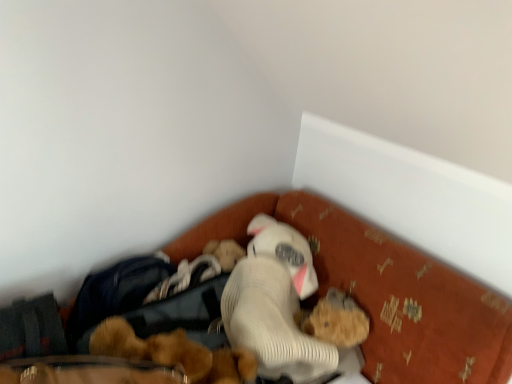
Question: Can you confirm if velvet orange bed at lower center is bigger than fluffy brown teddy bear at center, the second toy when ordered from right to left?

Choices:
 (A) yes
 (B) no

Answer: (A)

Question: Are velvet orange bed at lower center and fluffy brown teddy bear at center, the second toy when ordered from right to left, beside each other?

Choices:
 (A) yes
 (B) no

Answer: (B)

Question: Considering the relative sizes of velvet orange bed at lower center and fluffy brown teddy bear at center, the second toy when ordered from right to left, in the image provided, is velvet orange bed at lower center thinner than fluffy brown teddy bear at center, the second toy when ordered from right to left,?

Choices:
 (A) yes
 (B) no

Answer: (B)

Question: Does velvet orange bed at lower center appear on the left side of fluffy brown teddy bear at center, positioned as the 1th toy in left-to-right order?

Choices:
 (A) yes
 (B) no

Answer: (B)

Question: Considering the relative positions of velvet orange bed at lower center and fluffy brown teddy bear at center, positioned as the 1th toy in left-to-right order, in the image provided, is velvet orange bed at lower center in front of fluffy brown teddy bear at center, positioned as the 1th toy in left-to-right order,?

Choices:
 (A) yes
 (B) no

Answer: (A)

Question: Is point (150, 339) positioned closer to the camera than point (334, 289)?

Choices:
 (A) farther
 (B) closer

Answer: (B)

Question: Visually, is fluffy brown teddy bear at center, positioned as the 1th toy in left-to-right order, positioned to the left or to the right of fuzzy brown teddy bear at lower center, placed as the 1th toy when sorted from right to left?

Choices:
 (A) right
 (B) left

Answer: (B)

Question: Would you say fluffy brown teddy bear at center, positioned as the 1th toy in left-to-right order, is inside or outside fuzzy brown teddy bear at lower center, placed as the 1th toy when sorted from right to left?

Choices:
 (A) inside
 (B) outside

Answer: (B)

Question: Is fluffy brown teddy bear at center, positioned as the 1th toy in left-to-right order, in front of or behind fuzzy brown teddy bear at lower center, placed as the 1th toy when sorted from right to left, in the image?

Choices:
 (A) front
 (B) behind

Answer: (A)

Question: From the image's perspective, relative to white ribbed plush at center, is velvet orange bed at lower center above or below?

Choices:
 (A) below
 (B) above

Answer: (A)

Question: In terms of width, does velvet orange bed at lower center look wider or thinner when compared to white ribbed plush at center?

Choices:
 (A) thin
 (B) wide

Answer: (B)

Question: Would you say velvet orange bed at lower center is inside or outside white ribbed plush at center?

Choices:
 (A) outside
 (B) inside

Answer: (A)

Question: Is point (399, 306) positioned closer to the camera than point (275, 243)?

Choices:
 (A) farther
 (B) closer

Answer: (B)

Question: In terms of width, does fuzzy brown teddy bear at lower center, acting as the second toy starting from the left, look wider or thinner when compared to white ribbed plush at center?

Choices:
 (A) wide
 (B) thin

Answer: (B)

Question: Based on their positions, is fuzzy brown teddy bear at lower center, placed as the 1th toy when sorted from right to left, located to the left or right of white ribbed plush at center?

Choices:
 (A) right
 (B) left

Answer: (A)